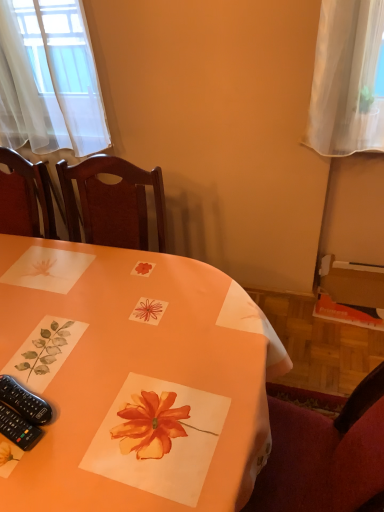
Where is `free point behind black plastic remote control at lower left, which is counted as the first remote control, starting from the top`? free point behind black plastic remote control at lower left, which is counted as the first remote control, starting from the top is located at coordinates (48, 345).